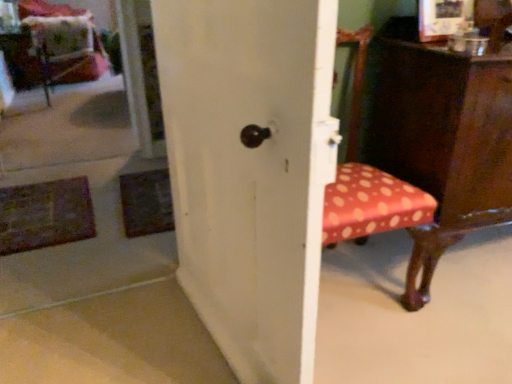
What is the approximate height of wooden picture frame at upper right?

wooden picture frame at upper right is 9.59 inches tall.

In order to face velvet cushion at upper left, should I rotate leftwards or rightwards?

Turn left by 24.405 degrees to look at velvet cushion at upper left.

Identify the location of wooden picture frame at upper right. (443, 18).

From the image's perspective, is velvet cushion at upper left above velvet polka dot swivel chair at upper left?

Actually, velvet cushion at upper left appears below velvet polka dot swivel chair at upper left in the image.

Would you say velvet cushion at upper left is to the left or to the right of velvet polka dot swivel chair at upper left in the picture?

velvet cushion at upper left is to the right of velvet polka dot swivel chair at upper left.

Does velvet cushion at upper left have a larger size compared to velvet polka dot swivel chair at upper left?

Actually, velvet cushion at upper left might be smaller than velvet polka dot swivel chair at upper left.

Is velvet cushion at upper left positioned behind velvet polka dot swivel chair at upper left?

That is True.

Does point (63, 35) lie behind point (242, 87)?

Yes, point (63, 35) is behind point (242, 87).

Is velvet cushion at upper left facing away from white matte door at center?

No.

From the image's perspective, which is below, velvet cushion at upper left or white matte door at center?

white matte door at center is shown below in the image.

Between velvet cushion at upper left and white matte door at center, which one has smaller size?

With smaller size is white matte door at center.

Consider the image. How different are the orientations of white matte door at center and velvet cushion at upper left in degrees?

The angle between the facing direction of white matte door at center and the facing direction of velvet cushion at upper left is 172 degrees.

From the image's perspective, is white matte door at center above or below velvet cushion at upper left?

Based on their image positions, white matte door at center is located beneath velvet cushion at upper left.

Is white matte door at center wider than velvet cushion at upper left?

Incorrect, the width of white matte door at center does not surpass that of velvet cushion at upper left.

Between velvet polka dot swivel chair at upper left and wooden picture frame at upper right, which one has larger size?

With larger size is velvet polka dot swivel chair at upper left.

Considering the relative sizes of velvet polka dot swivel chair at upper left and wooden picture frame at upper right in the image provided, is velvet polka dot swivel chair at upper left wider than wooden picture frame at upper right?

Yes.

Is velvet polka dot swivel chair at upper left facing towards wooden picture frame at upper right?

No, velvet polka dot swivel chair at upper left is not facing towards wooden picture frame at upper right.

Considering the positions of points (64, 8) and (451, 31), is point (64, 8) farther from camera compared to point (451, 31)?

Yes, it is behind point (451, 31).

Which object is wider, polka dot fabric chair at right or velvet cushion at upper left?

Wider between the two is velvet cushion at upper left.

Is polka dot fabric chair at right closer to the viewer compared to velvet cushion at upper left?

Yes, polka dot fabric chair at right is in front of velvet cushion at upper left.

Is polka dot fabric chair at right placed right next to velvet cushion at upper left?

No.

Could you tell me if velvet cushion at upper left is turned towards wooden picture frame at upper right?

No.

Does velvet cushion at upper left have a greater width compared to wooden picture frame at upper right?

Yes, velvet cushion at upper left is wider than wooden picture frame at upper right.

Who is smaller, velvet cushion at upper left or wooden picture frame at upper right?

wooden picture frame at upper right.

Would you say velvet cushion at upper left is a long distance from wooden picture frame at upper right?

Absolutely, velvet cushion at upper left is distant from wooden picture frame at upper right.

Is velvet polka dot swivel chair at upper left aimed at polka dot fabric chair at right?

No, velvet polka dot swivel chair at upper left is not facing towards polka dot fabric chair at right.

Is velvet polka dot swivel chair at upper left outside of polka dot fabric chair at right?

Indeed, velvet polka dot swivel chair at upper left is completely outside polka dot fabric chair at right.

Based on the photo, from the image's perspective, which one is positioned lower, velvet polka dot swivel chair at upper left or polka dot fabric chair at right?

From the image's view, polka dot fabric chair at right is below.

Considering the relative sizes of velvet polka dot swivel chair at upper left and polka dot fabric chair at right in the image provided, is velvet polka dot swivel chair at upper left wider than polka dot fabric chair at right?

Yes.

This screenshot has height=384, width=512. In order to click on swivel chair above the velvet cushion at upper left (from the image's perspective) in this screenshot , I will do `click(60, 45)`.

Locate an element on the screen. pillow that appears below the white matte door at center (from a real-world perspective) is located at coordinates (61, 35).

From the image, which object appears to be farther from white matte door at center, velvet polka dot swivel chair at upper left or polka dot fabric chair at right?

velvet polka dot swivel chair at upper left.

Which object lies further to the anchor point polka dot fabric chair at right, wooden picture frame at upper right or white matte door at center?

Among the two, white matte door at center is located further to polka dot fabric chair at right.

Considering their positions, is white matte door at center positioned further to polka dot fabric chair at right than wooden picture frame at upper right?

Among the two, white matte door at center is located further to polka dot fabric chair at right.

Which object lies nearer to the anchor point white matte door at center, wooden picture frame at upper right or polka dot fabric chair at right?

polka dot fabric chair at right is closer to white matte door at center.

When comparing their distances from white matte door at center, does polka dot fabric chair at right or velvet cushion at upper left seem further?

The object further to white matte door at center is velvet cushion at upper left.

From the image, which object appears to be farther from polka dot fabric chair at right, velvet polka dot swivel chair at upper left or white matte door at center?

velvet polka dot swivel chair at upper left is positioned further to the anchor polka dot fabric chair at right.

From the picture: From the image, which object appears to be nearer to polka dot fabric chair at right, velvet polka dot swivel chair at upper left or wooden picture frame at upper right?

wooden picture frame at upper right is closer to polka dot fabric chair at right.

Estimate the real-world distances between objects in this image. Which object is closer to velvet cushion at upper left, polka dot fabric chair at right or wooden picture frame at upper right?

Based on the image, polka dot fabric chair at right appears to be nearer to velvet cushion at upper left.

I want to click on pillow between velvet polka dot swivel chair at upper left and polka dot fabric chair at right from left to right, so click(x=61, y=35).

Where is `furniture between white matte door at center and velvet cushion at upper left in the front-back direction`? furniture between white matte door at center and velvet cushion at upper left in the front-back direction is located at coordinates (441, 139).

This screenshot has height=384, width=512. What are the coordinates of `picture frame between white matte door at center and polka dot fabric chair at right from left to right` in the screenshot? It's located at (443, 18).

The height and width of the screenshot is (384, 512). In order to click on picture frame between white matte door at center and velvet cushion at upper left in the front-back direction in this screenshot , I will do `click(443, 18)`.